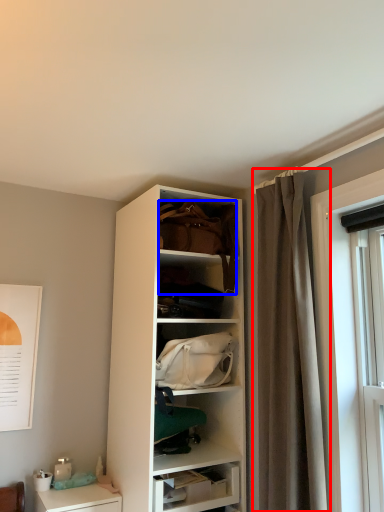
Question: Which of the following is the closest to the observer, curtain (highlighted by a red box) or handbag (highlighted by a blue box)?

Choices:
 (A) curtain
 (B) handbag

Answer: (A)